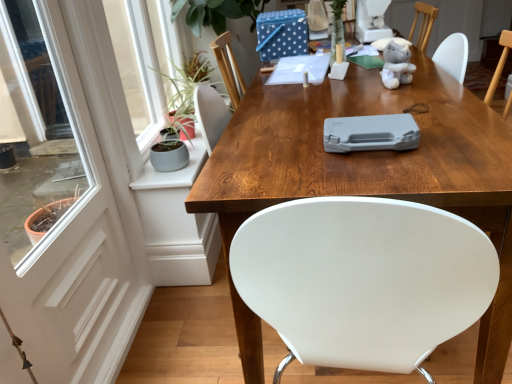
Question: Is soft gray plush bear at upper right wider than wooden table at center?

Choices:
 (A) no
 (B) yes

Answer: (A)

Question: Is soft gray plush bear at upper right next to wooden table at center?

Choices:
 (A) yes
 (B) no

Answer: (B)

Question: From the image's perspective, is soft gray plush bear at upper right under wooden table at center?

Choices:
 (A) yes
 (B) no

Answer: (B)

Question: Can you confirm if soft gray plush bear at upper right is thinner than wooden table at center?

Choices:
 (A) no
 (B) yes

Answer: (B)

Question: Considering the relative sizes of soft gray plush bear at upper right and wooden table at center in the image provided, is soft gray plush bear at upper right taller than wooden table at center?

Choices:
 (A) yes
 (B) no

Answer: (B)

Question: From a real-world perspective, is soft gray plush bear at upper right above or below wooden table at center?

Choices:
 (A) below
 (B) above

Answer: (B)

Question: Considering their positions, is soft gray plush bear at upper right located in front of or behind wooden table at center?

Choices:
 (A) front
 (B) behind

Answer: (B)

Question: Which is correct: soft gray plush bear at upper right is inside wooden table at center, or outside of it?

Choices:
 (A) inside
 (B) outside

Answer: (B)

Question: In terms of height, does soft gray plush bear at upper right look taller or shorter compared to wooden table at center?

Choices:
 (A) short
 (B) tall

Answer: (A)

Question: From a real-world perspective, is white glossy screen door at left positioned above or below wooden table at center?

Choices:
 (A) above
 (B) below

Answer: (A)

Question: Is point (79, 322) positioned closer to the camera than point (436, 97)?

Choices:
 (A) farther
 (B) closer

Answer: (A)

Question: Is white glossy screen door at left taller or shorter than wooden table at center?

Choices:
 (A) short
 (B) tall

Answer: (B)

Question: Is white glossy screen door at left inside or outside of wooden table at center?

Choices:
 (A) outside
 (B) inside

Answer: (A)

Question: From the image's perspective, relative to soft gray plush bear at upper right, is wooden table at center above or below?

Choices:
 (A) below
 (B) above

Answer: (A)

Question: From a real-world perspective, is wooden table at center positioned above or below soft gray plush bear at upper right?

Choices:
 (A) below
 (B) above

Answer: (A)